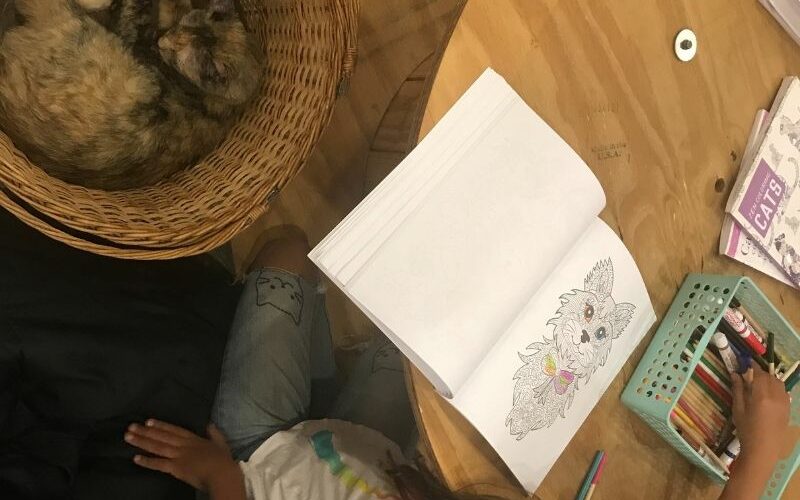
Where is `art basket`? This screenshot has width=800, height=500. art basket is located at coordinates (701, 392).